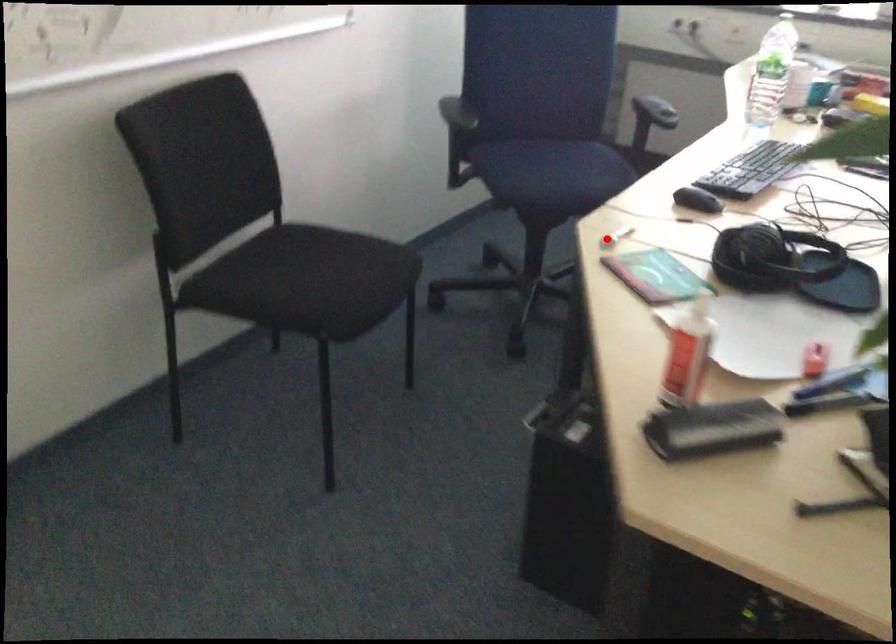
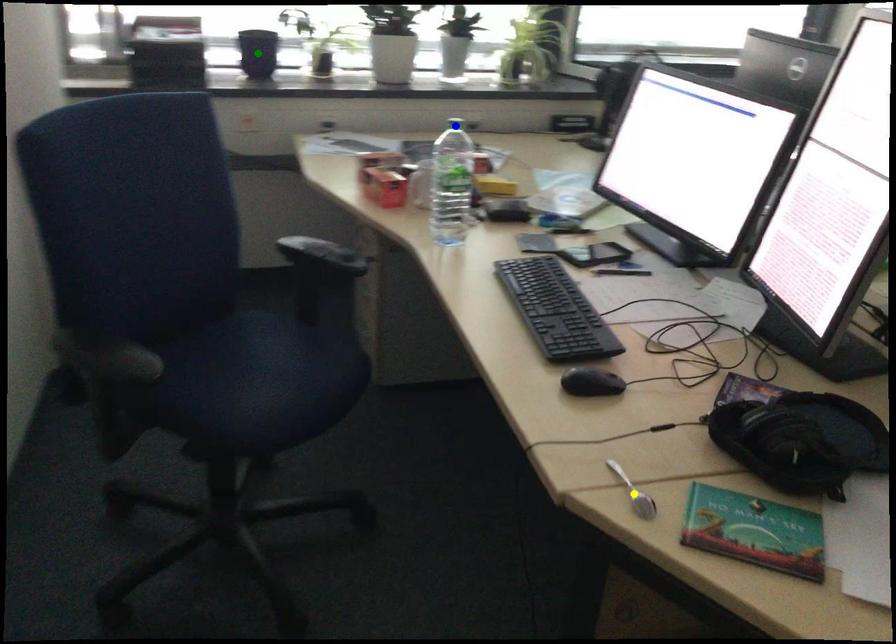
Question: I am providing you with two images of the same scene from different viewpoints. A red point is marked on the first image. You are given multiple points on the second image. In image 2, which mark is for the same physical point as the one in image 1?

Choices:
 (A) yellow point
 (B) blue point
 (C) green point

Answer: (A)